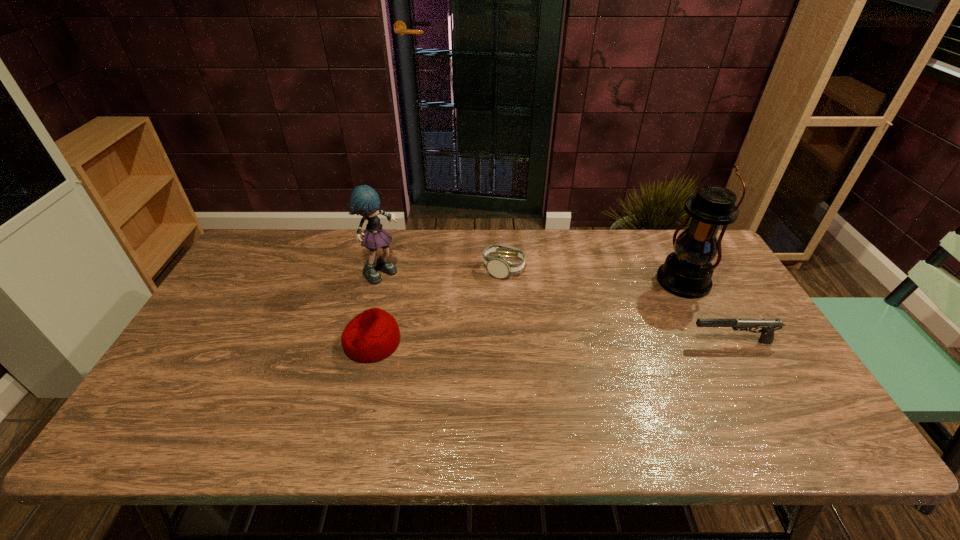
Identify the location of rag doll that is at the far edge. The width and height of the screenshot is (960, 540). (364, 201).

You are a GUI agent. You are given a task and a screenshot of the screen. Output one action in this format:
    pyautogui.click(x=<x>, y=<y>)
    Task: Click on the watch that is at the far edge
    The height and width of the screenshot is (540, 960).
    Given the screenshot: What is the action you would take?
    pyautogui.click(x=499, y=267)

Locate an element on the screen. Image resolution: width=960 pixels, height=540 pixels. lantern present at the far edge is located at coordinates (687, 272).

The height and width of the screenshot is (540, 960). What are the coordinates of `gun situated at the right edge` in the screenshot? It's located at (768, 326).

Find the location of `lantern that is at the right edge`. lantern that is at the right edge is located at coordinates (687, 272).

Locate an element on the screen. object positioned at the far right corner is located at coordinates (687, 272).

Identify the location of vacant area at the far edge of the desktop. The height and width of the screenshot is (540, 960). (635, 252).

Where is `free space at the near edge of the desktop`? This screenshot has height=540, width=960. free space at the near edge of the desktop is located at coordinates (696, 395).

Identify the location of free location at the left edge of the desktop. This screenshot has width=960, height=540. (265, 278).

In the image, there is a desktop. At what (x,y) coordinates should I click in order to perform the action: click on vacant region at the right edge. Please return your answer as a coordinate pair (x, y). The image size is (960, 540). Looking at the image, I should click on (786, 369).